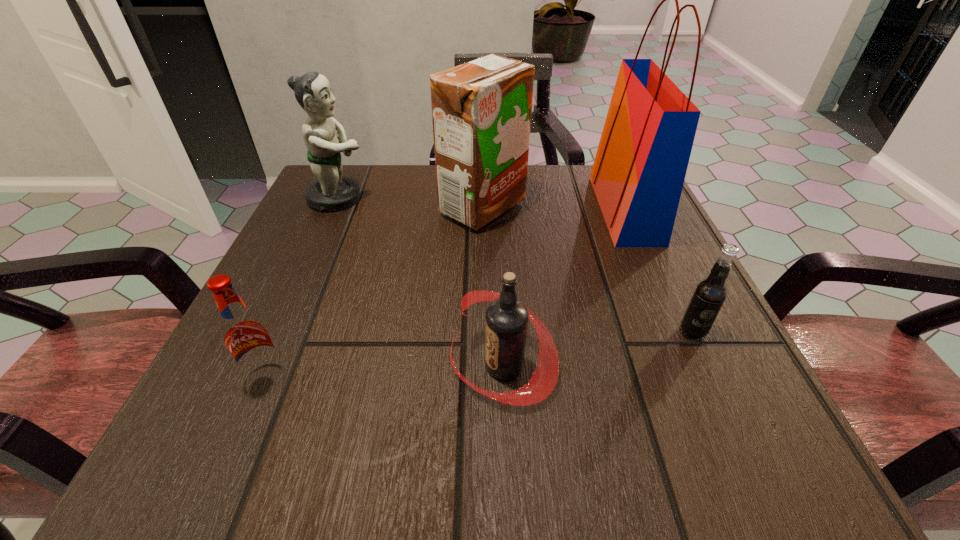
Locate an element on the screen. figurine located at the far edge is located at coordinates (330, 191).

The width and height of the screenshot is (960, 540). I want to click on object located in the near edge section of the desktop, so click(507, 318).

The image size is (960, 540). In order to click on figurine situated at the left edge in this screenshot , I will do `click(330, 191)`.

What are the coordinates of `root beer that is at the left edge` in the screenshot? It's located at click(x=245, y=334).

Find the location of a particular element. shopping bag present at the right edge is located at coordinates (638, 173).

This screenshot has width=960, height=540. Identify the location of root beer that is positioned at the right edge. (710, 293).

Locate an element on the screen. This screenshot has height=540, width=960. object at the far left corner is located at coordinates (330, 191).

Where is `object that is at the far right corner`? object that is at the far right corner is located at coordinates (638, 173).

In the image, there is a desktop. At what (x,y) coordinates should I click in order to perform the action: click on vacant area at the far edge. Please return your answer as a coordinate pair (x, y). Looking at the image, I should click on (566, 191).

Locate an element on the screen. vacant space at the near edge of the desktop is located at coordinates (618, 434).